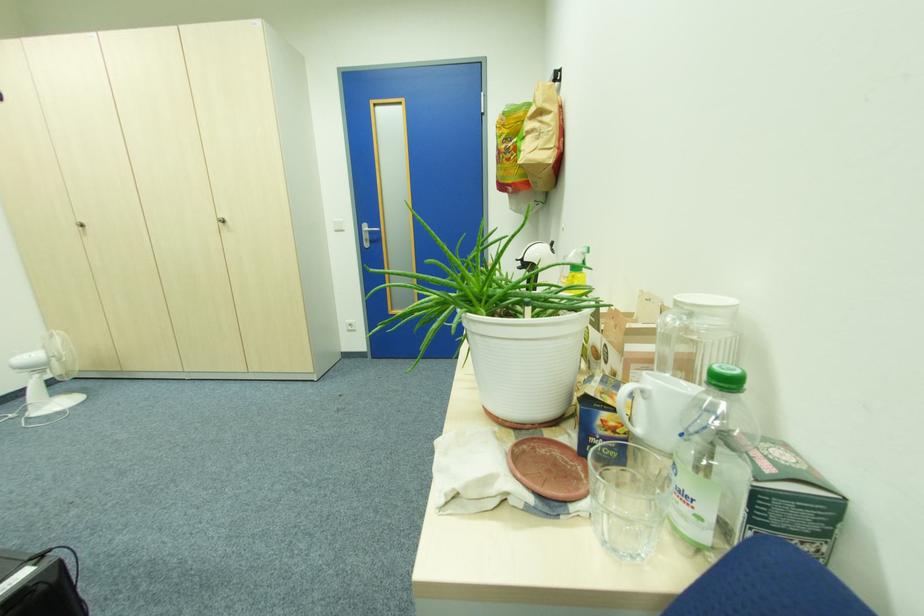
Describe the element at coordinates (1, 1) in the screenshot. I see `the green bottle cap` at that location.